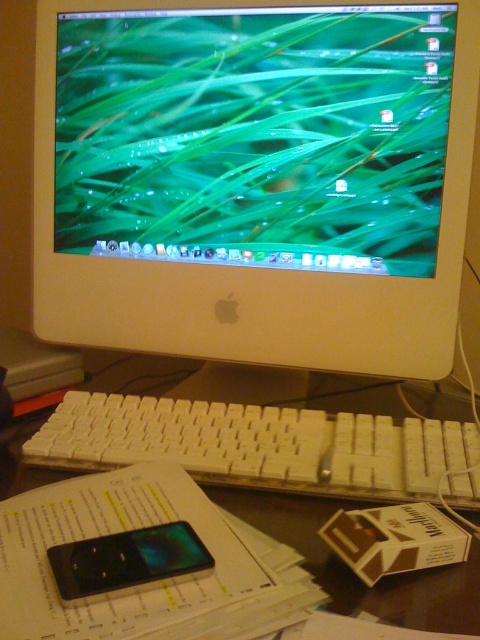
Question: Where is white plastic monitor at center located in relation to white plastic keyboard at center in the image?

Choices:
 (A) right
 (B) left

Answer: (B)

Question: Which point is closer to the camera?

Choices:
 (A) white plastic keyboard at center
 (B) white plastic monitor at center

Answer: (A)

Question: Can you confirm if white plastic keyboard at center is positioned below white plastic keyboard at lower center?

Choices:
 (A) yes
 (B) no

Answer: (A)

Question: Which point is closer to the camera taking this photo?

Choices:
 (A) (345, 122)
 (B) (360, 589)

Answer: (B)

Question: Does white plastic keyboard at center appear on the left side of white plastic keyboard at lower center?

Choices:
 (A) no
 (B) yes

Answer: (B)

Question: Which of the following is the farthest from the observer?

Choices:
 (A) white plastic keyboard at lower center
 (B) white plastic keyboard at center

Answer: (B)